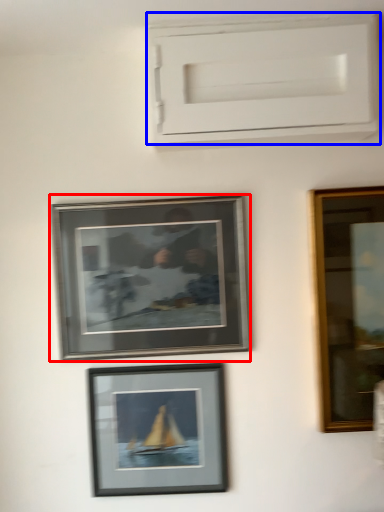
Question: Among these objects, which one is nearest to the camera, picture frame (highlighted by a red box) or window frame (highlighted by a blue box)?

Choices:
 (A) picture frame
 (B) window frame

Answer: (B)